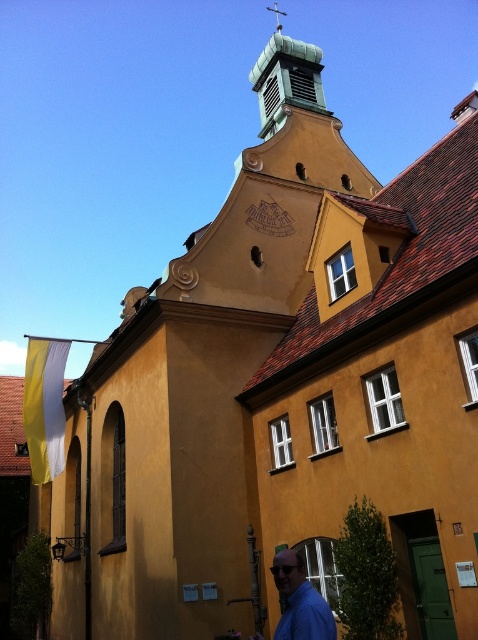
Question: Does green copper spire at upper center appear over blue matte shirt at lower right?

Choices:
 (A) no
 (B) yes

Answer: (B)

Question: Is green copper spire at upper center closer to camera compared to blue matte shirt at lower right?

Choices:
 (A) yes
 (B) no

Answer: (B)

Question: Which point is farther to the camera?

Choices:
 (A) blue matte shirt at lower right
 (B) green copper spire at upper center

Answer: (B)

Question: Does green copper spire at upper center have a lesser width compared to blue matte shirt at lower right?

Choices:
 (A) yes
 (B) no

Answer: (B)